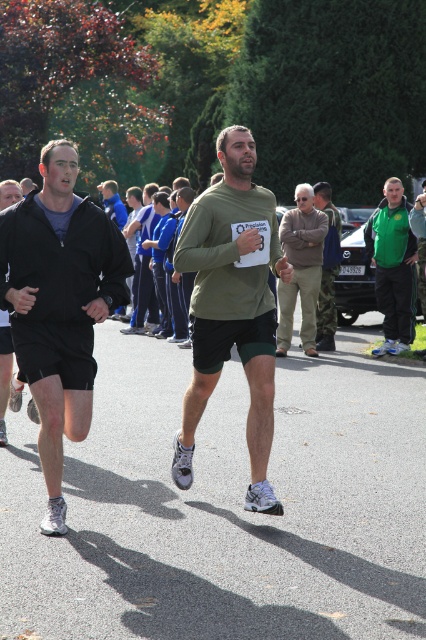
Who is more distant from viewer, [255,278] or [328,310]?

Point [328,310]

Does point (256, 481) come farther from viewer compared to point (322, 208)?

That is False.

Find the location of `green matte shirt at center`. green matte shirt at center is located at coordinates (x=232, y=307).

Does matte black jacket at left have a lesser width compared to camouflage pants at center?

Incorrect, matte black jacket at left's width is not less than camouflage pants at center's.

Who is higher up, matte black jacket at left or camouflage pants at center?

Positioned higher is camouflage pants at center.

Find the location of a particular element. matte black jacket at left is located at coordinates (60, 305).

How far apart are green fabric jacket at right and tan fabric jacket at center?

green fabric jacket at right is 1.09 meters from tan fabric jacket at center.

Between green fabric jacket at right and tan fabric jacket at center, which one has less height?

With less height is green fabric jacket at right.

Does point (391, 321) come farther from viewer compared to point (299, 188)?

Yes, it is behind point (299, 188).

You are a GUI agent. You are given a task and a screenshot of the screen. Output one action in this format:
    pyautogui.click(x=<x>, y=<y>)
    Task: Click on the green fabric jacket at right
    The height and width of the screenshot is (640, 426).
    Given the screenshot: What is the action you would take?
    pyautogui.click(x=393, y=266)